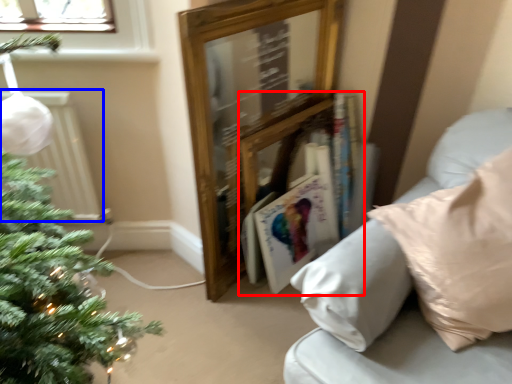
Question: Among these objects, which one is farthest to the camera, book (highlighted by a red box) or radiator (highlighted by a blue box)?

Choices:
 (A) book
 (B) radiator

Answer: (A)